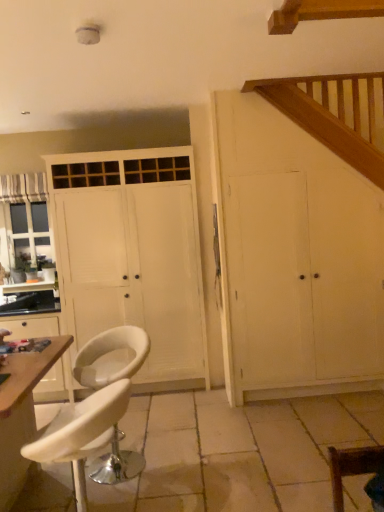
Find the location of a particular element. blank space above striped fabric curtain at left (from a real-world perspective) is located at coordinates (25, 173).